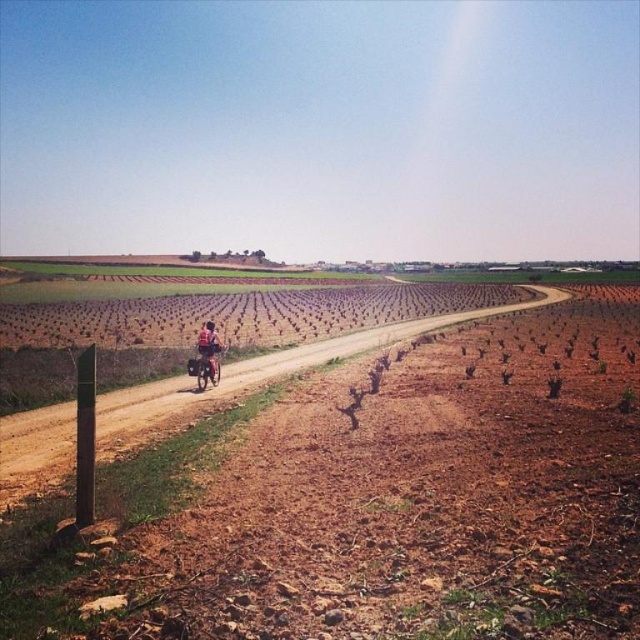
You are standing at the edge of the dirt road and see both the metallic silver dirt bike at center and the matte black bicycle at center. Which vehicle is closer to you?

The metallic silver dirt bike at center is closer to you because it is positioned further to the viewer than the matte black bicycle at center.

You are a delivery person on a motorcycle that is 1.5 meters wide. You see the metallic silver dirt bike at center and the matte black bicycle at center on the dirt road. Can your motorcycle fit between them without touching either?

The metallic silver dirt bike at center and the matte black bicycle at center are 2.61 meters apart. Since your motorcycle is 1.5 meters wide, there is enough space between them for the motorcycle to pass through without touching either vehicle.